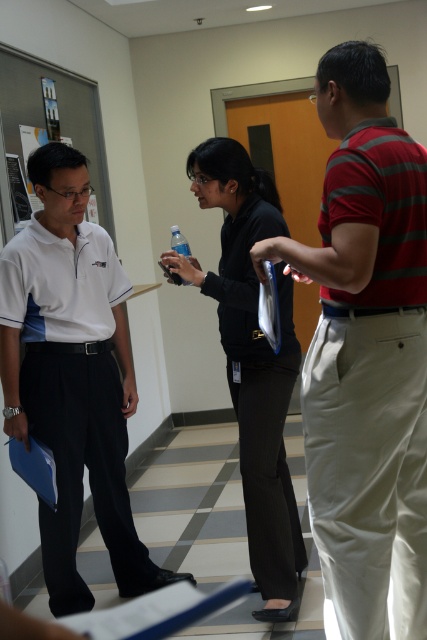
You are a security guard in this office hallway and need to identify which person is shorter between the white smooth polo shirt at left and the black matte pants at center. Based on the scene, which one is shorter?

The white smooth polo shirt at left is not as tall as the black matte pants at center, so the person wearing the white smooth polo shirt at left is shorter.